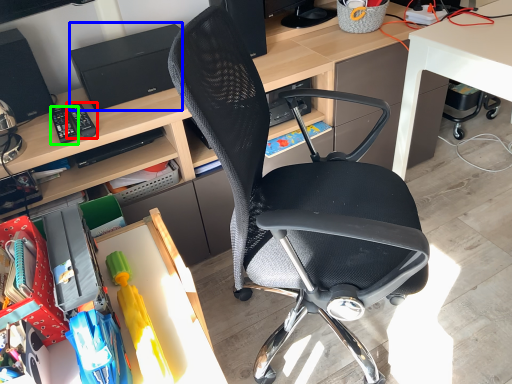
Question: Which is farther away from remote control (highlighted by a red box)? printer (highlighted by a blue box) or remote control (highlighted by a green box)?

Choices:
 (A) printer
 (B) remote control

Answer: (A)